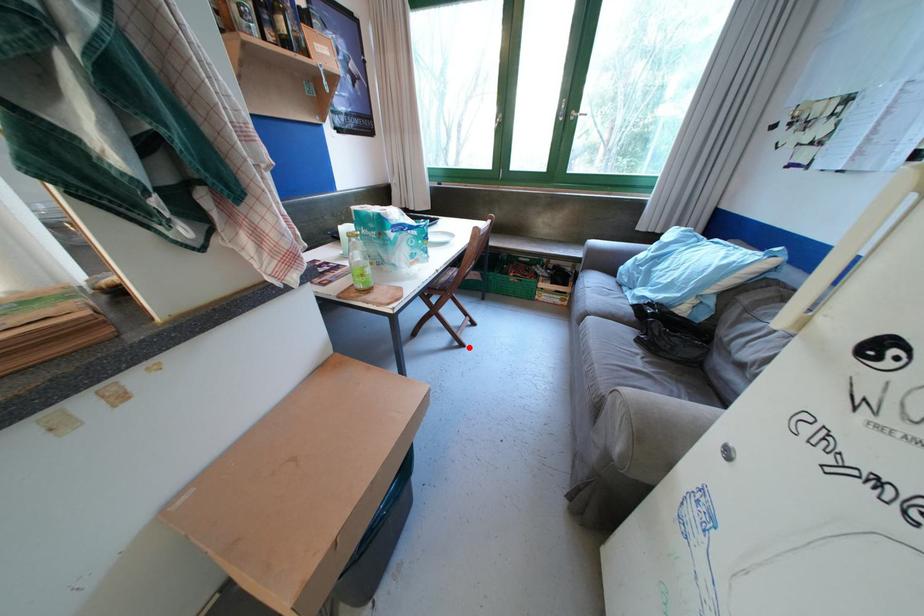
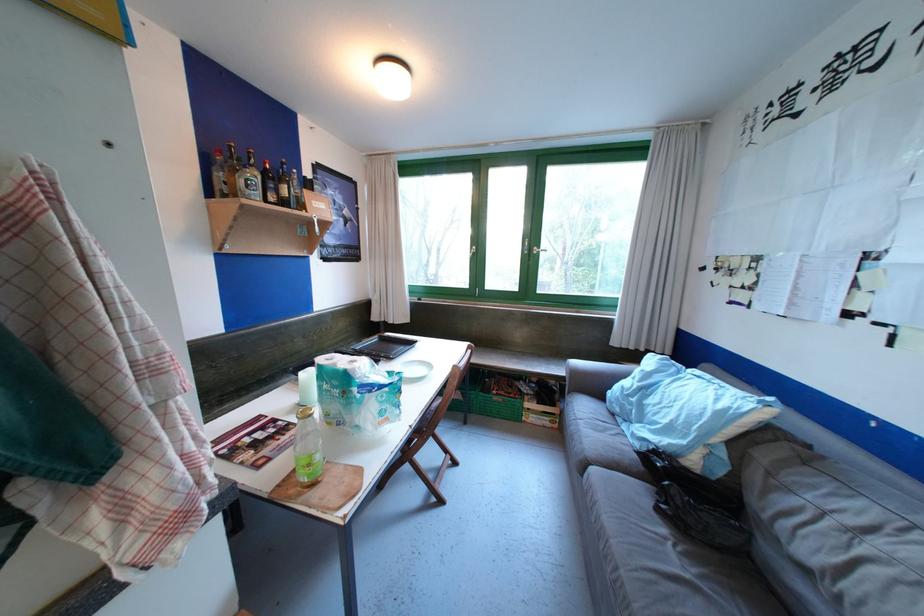
Locate, in the second image, the point that corresponds to the highlighted location in the first image.

(448, 504)